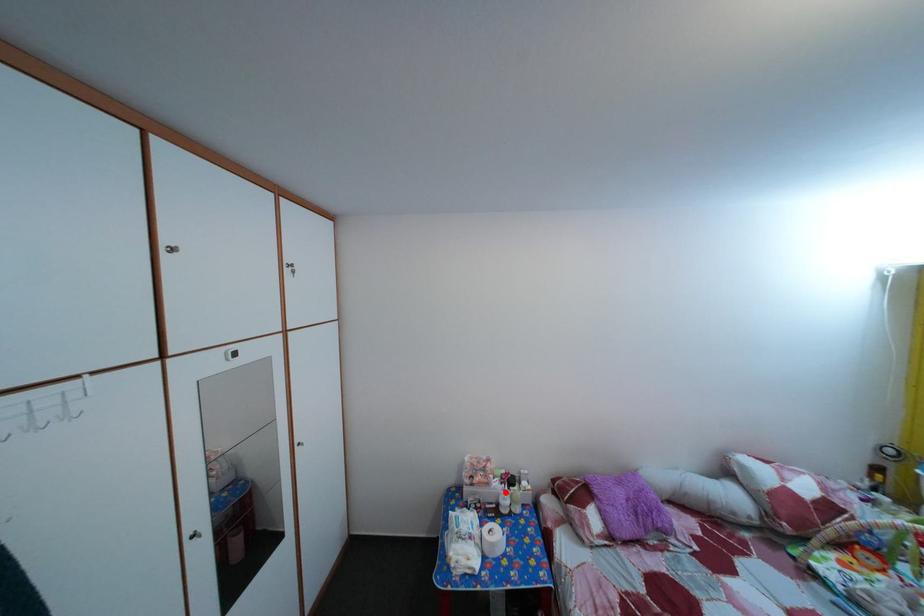
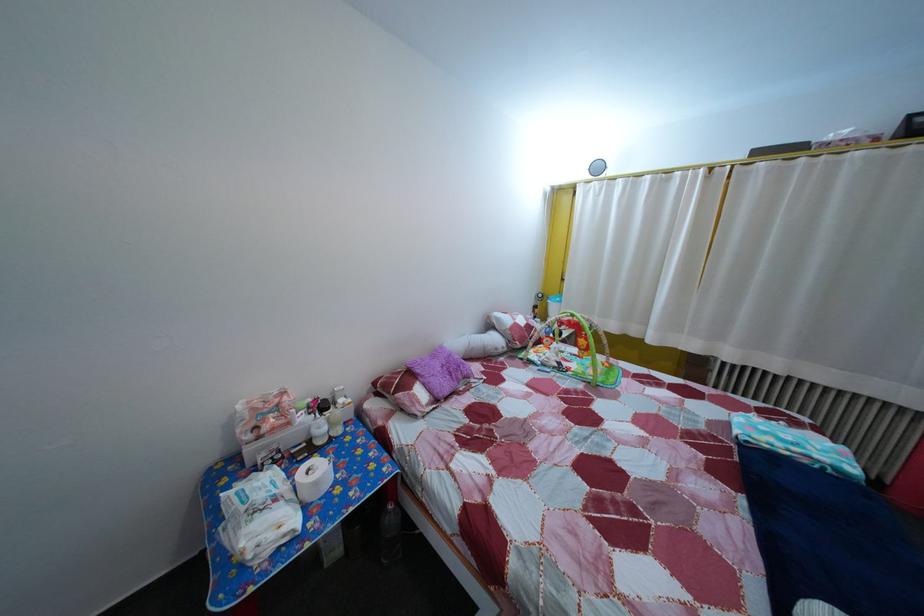
The point at the highlighted location is marked in the first image. Where is the corresponding point in the second image?

(311, 427)